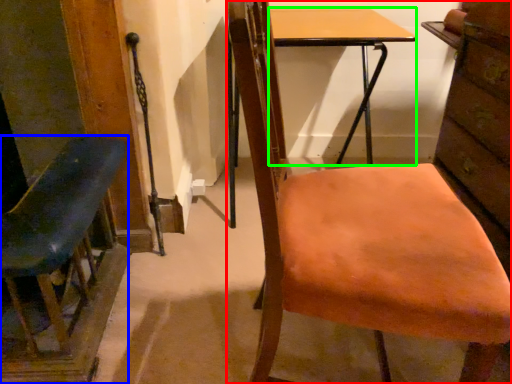
Question: Which is farther away from chair (highlighted by a red box)? chair (highlighted by a blue box) or desk (highlighted by a green box)?

Choices:
 (A) chair
 (B) desk

Answer: (B)